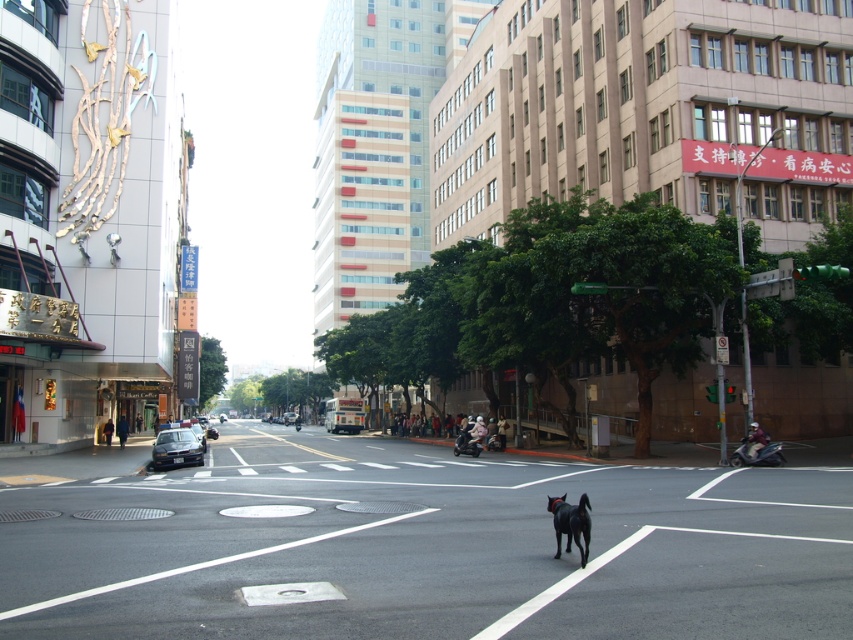
Question: Which of the following is the farthest from the observer?

Choices:
 (A) shiny black sedan at center-left
 (B) black asphalt road at center

Answer: (A)

Question: Does black asphalt road at center have a greater width compared to shiny black sedan at center-left?

Choices:
 (A) yes
 (B) no

Answer: (A)

Question: Estimate the real-world distances between objects in this image. Which object is closer to the black glossy dog at center?

Choices:
 (A) shiny black sedan at center-left
 (B) black asphalt road at center

Answer: (B)

Question: Observing the image, what is the correct spatial positioning of black glossy dog at center in reference to shiny black sedan at center-left?

Choices:
 (A) right
 (B) left

Answer: (A)

Question: From the image, what is the correct spatial relationship of black asphalt road at center in relation to black glossy dog at center?

Choices:
 (A) above
 (B) below

Answer: (B)

Question: Among these points, which one is nearest to the camera?

Choices:
 (A) (125, 518)
 (B) (169, 440)
 (C) (550, 502)

Answer: (C)